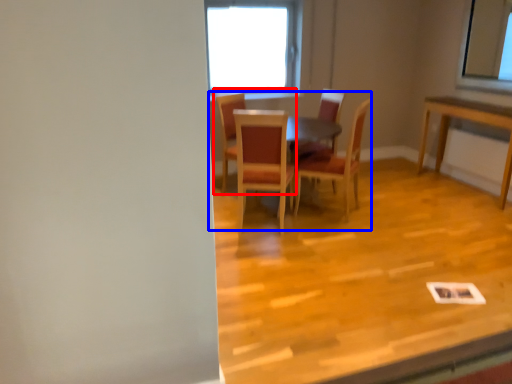
Question: Which object is further to the camera taking this photo, chair (highlighted by a red box) or table (highlighted by a blue box)?

Choices:
 (A) chair
 (B) table

Answer: (A)